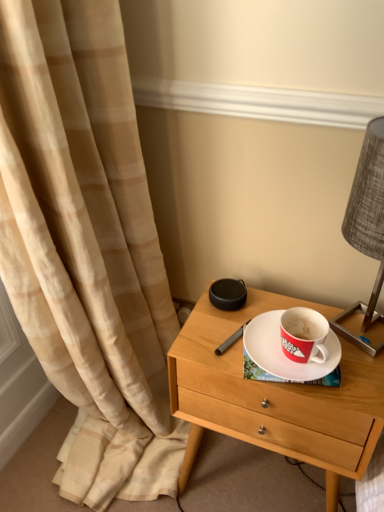
You are a GUI agent. You are given a task and a screenshot of the screen. Output one action in this format:
    pyautogui.click(x=<x>, y=<y>)
    Task: Click on the vacant space underneath textured gray lampshade at right (from a real-world perspective)
    The height and width of the screenshot is (512, 384).
    Given the screenshot: What is the action you would take?
    pyautogui.click(x=354, y=329)